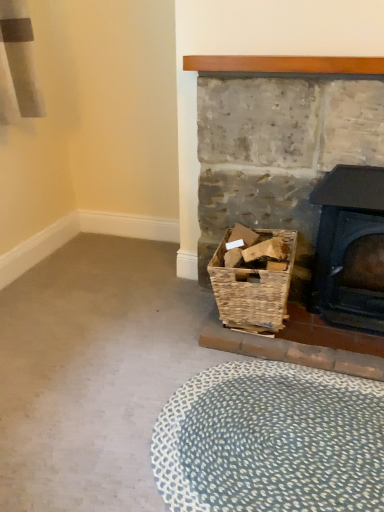
At what (x,y) coordinates should I click in order to perform the action: click on vacant space situated on the left part of blue textured rug at lower center. Please return your answer as a coordinate pair (x, y). Looking at the image, I should click on (89, 408).